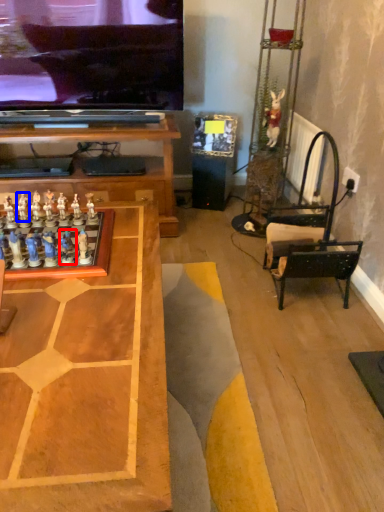
Question: Which of the following is the farthest to the observer, toy (highlighted by a red box) or toy (highlighted by a blue box)?

Choices:
 (A) toy
 (B) toy

Answer: (B)